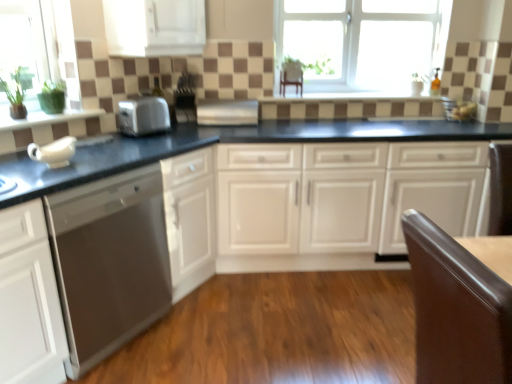
This screenshot has height=384, width=512. What are the coordinates of `vacant space in front of satin silver toaster at center` in the screenshot? It's located at (145, 146).